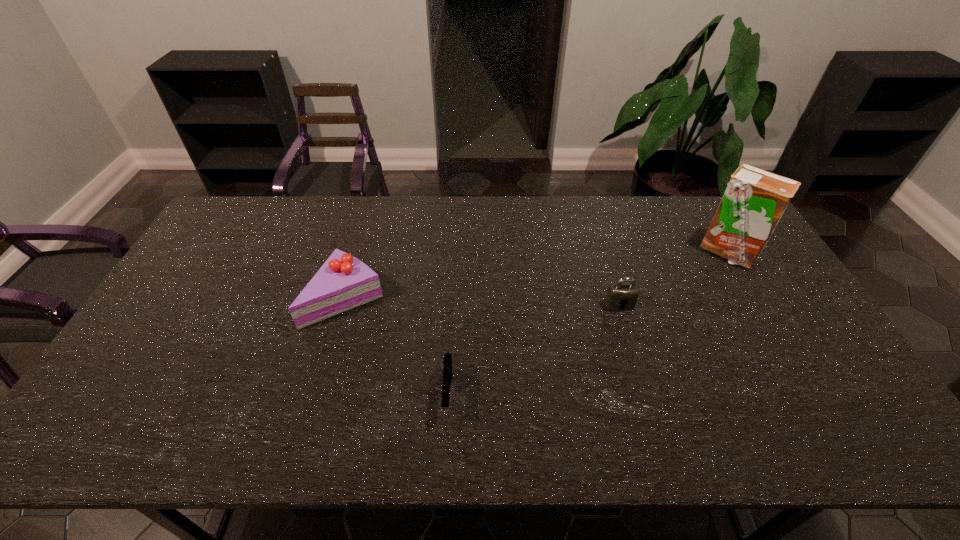
Where is `the tallest object`? The height and width of the screenshot is (540, 960). the tallest object is located at coordinates (754, 201).

The image size is (960, 540). Find the location of `the rightmost object`. the rightmost object is located at coordinates (754, 201).

This screenshot has height=540, width=960. Find the location of `cake`. cake is located at coordinates (343, 282).

Identify the location of the second object from right to left. (620, 296).

Where is `the nearest object`? Image resolution: width=960 pixels, height=540 pixels. the nearest object is located at coordinates (447, 367).

Image resolution: width=960 pixels, height=540 pixels. I want to click on the shortest object, so click(447, 367).

Image resolution: width=960 pixels, height=540 pixels. In order to click on free space located 0.110m on the straw side of the rightmost object in this screenshot , I will do (x=754, y=297).

Where is `free region located on the back of the cake`? This screenshot has height=540, width=960. free region located on the back of the cake is located at coordinates (371, 214).

I want to click on vacant space situated 0.350m at the front of the second object from right to left near the keyhole, so click(655, 427).

Identify the location of object that is at the far edge. The width and height of the screenshot is (960, 540). (754, 201).